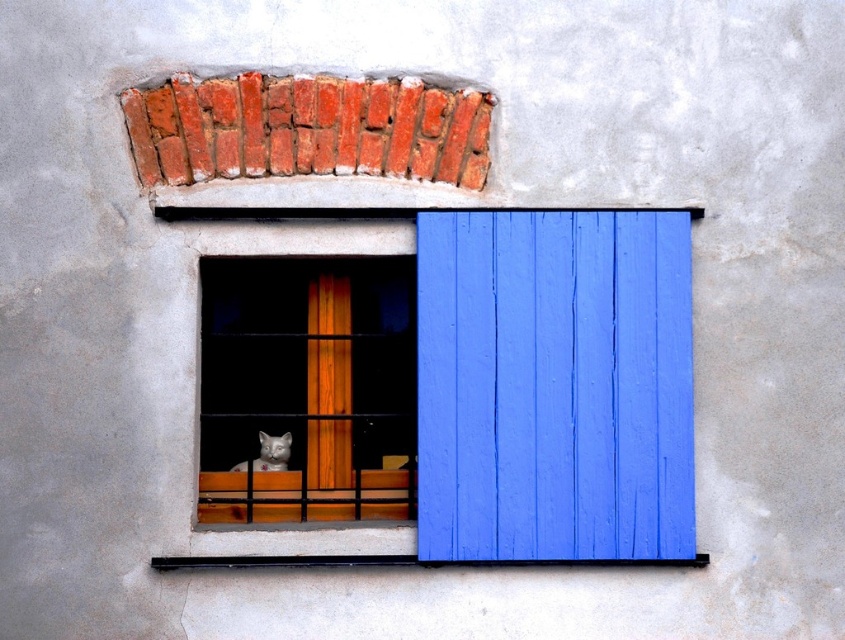
Question: Among these objects, which one is farthest from the camera?

Choices:
 (A) white fur cat at window center
 (B) blue painted wood at right

Answer: (A)

Question: Which object appears farthest from the camera in this image?

Choices:
 (A) blue painted wood at right
 (B) wooden window frame at center

Answer: (A)

Question: Does white glossy cat at center appear under wooden window frame at center?

Choices:
 (A) no
 (B) yes

Answer: (A)

Question: Which of these objects is positioned farthest from the wooden window frame at center?

Choices:
 (A) blue painted wood at right
 (B) white fur cat at window center
 (C) white glossy cat at center

Answer: (A)

Question: Can you confirm if white glossy cat at center is positioned above wooden window frame at center?

Choices:
 (A) yes
 (B) no

Answer: (A)

Question: Does blue painted wood at right have a smaller size compared to white fur cat at window center?

Choices:
 (A) no
 (B) yes

Answer: (A)